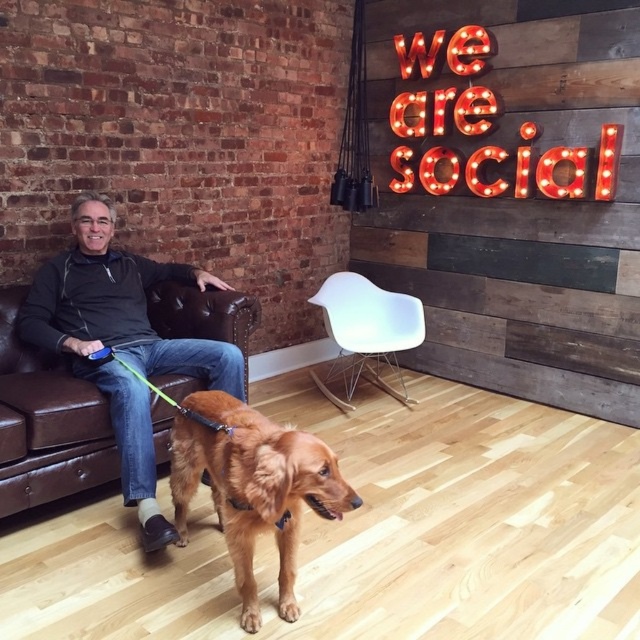
Who is positioned more to the left, matte black leather couch at left or red illuminated letters at upper right?

matte black leather couch at left is more to the left.

Does matte black leather couch at left appear over red illuminated letters at upper right?

No, matte black leather couch at left is not above red illuminated letters at upper right.

Is point (92, 240) less distant than point (483, 154)?

Yes, point (92, 240) is in front of point (483, 154).

At what (x,y) coordinates should I click in order to perform the action: click on matte black leather couch at left. Please return your answer as a coordinate pair (x, y). Looking at the image, I should click on (122, 340).

Does red illuminated letters at upper right have a larger size compared to white plastic chair at center?

Yes.

Between point (417, 67) and point (397, 317), which one is positioned in front?

Point (397, 317) is more forward.

Locate an element on the screen. Image resolution: width=640 pixels, height=640 pixels. red illuminated letters at upper right is located at coordinates (496, 163).

Between matte black leather couch at left and white plastic chair at center, which one is positioned higher?

white plastic chair at center is above.

Is matte black leather couch at left taller than white plastic chair at center?

Yes.

Between point (154, 472) and point (412, 307), which one is positioned in front?

Point (154, 472) is in front.

This screenshot has height=640, width=640. Identify the location of matte black leather couch at left. (122, 340).